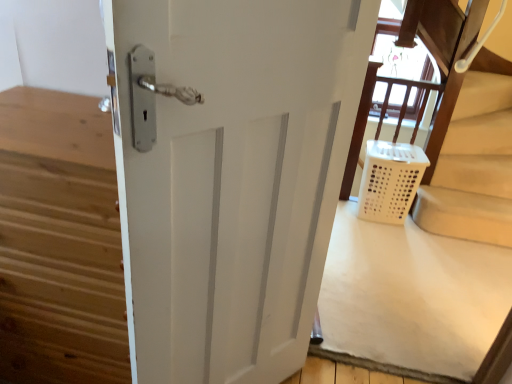
Question: Can you confirm if white plastic laundry basket at lower right is thinner than white plastic laundry basket at lower right?

Choices:
 (A) no
 (B) yes

Answer: (A)

Question: From the image's perspective, is white plastic laundry basket at lower right located above white plastic laundry basket at lower right?

Choices:
 (A) yes
 (B) no

Answer: (A)

Question: Is white plastic laundry basket at lower right positioned beyond the bounds of white plastic laundry basket at lower right?

Choices:
 (A) no
 (B) yes

Answer: (B)

Question: Could you tell me if white plastic laundry basket at lower right is turned towards white plastic laundry basket at lower right?

Choices:
 (A) no
 (B) yes

Answer: (B)

Question: Is white plastic laundry basket at lower right wider than white plastic laundry basket at lower right?

Choices:
 (A) yes
 (B) no

Answer: (A)

Question: Is white plastic laundry basket at lower right inside white plastic laundry basket at lower right?

Choices:
 (A) no
 (B) yes

Answer: (A)

Question: Is white matte door at center positioned in front of white plastic laundry basket at lower right?

Choices:
 (A) yes
 (B) no

Answer: (A)

Question: Is white plastic laundry basket at lower right a part of white matte door at center?

Choices:
 (A) yes
 (B) no

Answer: (B)

Question: Considering the relative sizes of white matte door at center and white plastic laundry basket at lower right in the image provided, is white matte door at center taller than white plastic laundry basket at lower right?

Choices:
 (A) no
 (B) yes

Answer: (B)

Question: Is white matte door at center behind white plastic laundry basket at lower right?

Choices:
 (A) yes
 (B) no

Answer: (B)

Question: From a real-world perspective, is white matte door at center positioned under white plastic laundry basket at lower right based on gravity?

Choices:
 (A) yes
 (B) no

Answer: (B)

Question: Can you confirm if white matte door at center is positioned to the right of white plastic laundry basket at lower right?

Choices:
 (A) no
 (B) yes

Answer: (A)

Question: From the image's perspective, is white plastic laundry basket at lower right above white matte door at center?

Choices:
 (A) yes
 (B) no

Answer: (A)